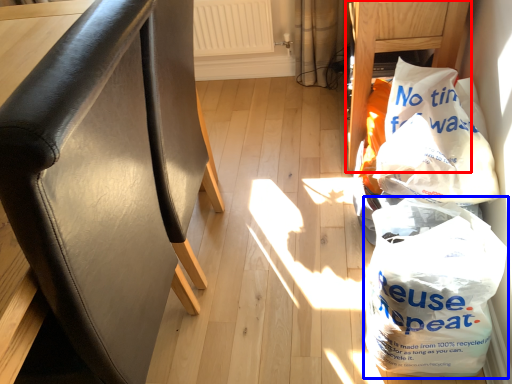
Question: Which object is further to the camera taking this photo, furniture (highlighted by a red box) or plastic bag (highlighted by a blue box)?

Choices:
 (A) furniture
 (B) plastic bag

Answer: (A)